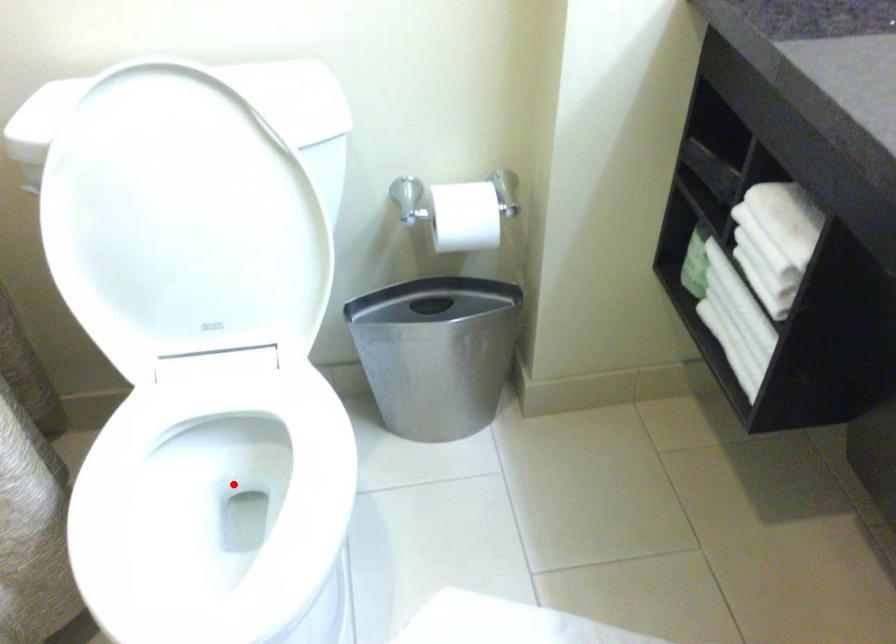
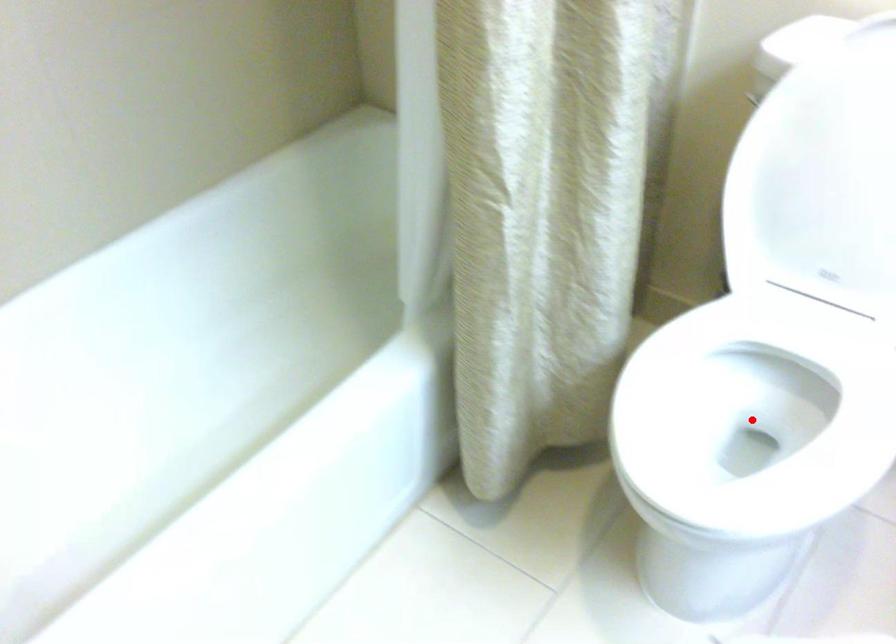
I am providing you with two images of the same scene from different viewpoints. A red point is marked on the first image and another point is marked on the second image. Is the red point in image1 aligned with the point shown in image2?

Yes